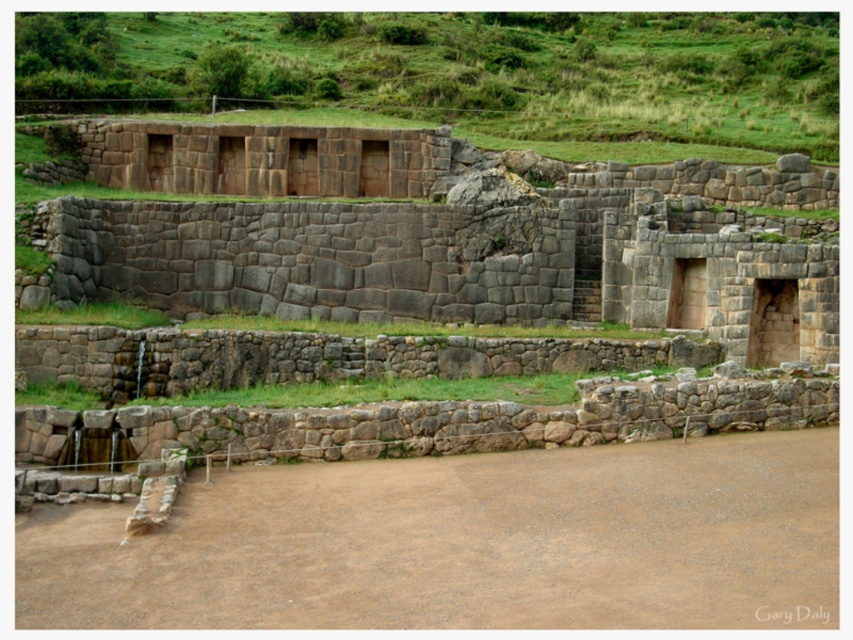
Can you confirm if green grass at upper center is smaller than white paper at center?

No, green grass at upper center is not smaller than white paper at center.

Based on the photo, which of these two, green grass at upper center or white paper at center, stands taller?

green grass at upper center is taller.

Is point (30, 108) farther from camera compared to point (805, 609)?

That is True.

Where is `green grass at upper center`? green grass at upper center is located at coordinates (459, 70).

Between gray stone wall at upper center and white paper at center, which one has less height?

white paper at center is shorter.

Can you confirm if gray stone wall at upper center is bigger than white paper at center?

Yes.

Between point (828, 241) and point (759, 608), which one is positioned behind?

The point (828, 241) is more distant.

Identify the location of gray stone wall at upper center. The image size is (853, 640). point(436,236).

Is gray stone wall at upper center in front of green grass at upper center?

Yes.

Can you confirm if gray stone wall at upper center is thinner than green grass at upper center?

Yes, gray stone wall at upper center is thinner than green grass at upper center.

Is point (180, 170) positioned behind point (370, 70)?

No.

Locate an element on the screen. This screenshot has width=853, height=640. gray stone wall at upper center is located at coordinates (436, 236).